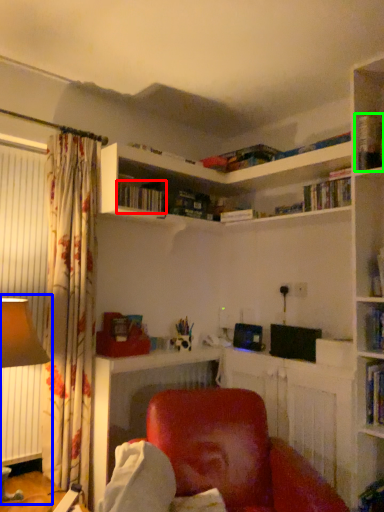
Question: Which object is the closest to the book (highlighted by a red box)? Choose among these: table lamp (highlighted by a blue box) or book (highlighted by a green box).

Choices:
 (A) table lamp
 (B) book

Answer: (A)